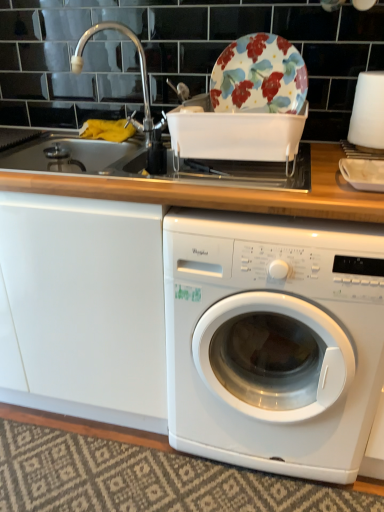
Describe the element at coordinates (259, 76) in the screenshot. The width and height of the screenshot is (384, 512). I see `floral ceramic plate at upper center` at that location.

You are a GUI agent. You are given a task and a screenshot of the screen. Output one action in this format:
    pyautogui.click(x=<x>, y=<y>)
    Task: Click on the white matte plate at right
    
    Given the screenshot: What is the action you would take?
    pyautogui.click(x=363, y=173)

The image size is (384, 512). I want to click on table in front of the silver metallic faucet at upper left, so click(x=259, y=76).

Is floral ceramic plate at upper center positioned far away from silver metallic faucet at upper left?

No.

Is floral ceramic plate at upper center turned away from silver metallic faucet at upper left?

floral ceramic plate at upper center does not have its back to silver metallic faucet at upper left.

How different are the orientations of floral ceramic plate at upper center and silver metallic faucet at upper left in degrees?

There is a 54.7-degree angle between the facing directions of floral ceramic plate at upper center and silver metallic faucet at upper left.

Find the location of `tableware above the white plastic washing machine at center (from the image's perspective)`. tableware above the white plastic washing machine at center (from the image's perspective) is located at coordinates coord(363,173).

Can you see white plastic washing machine at center touching white matte plate at right?

No, white plastic washing machine at center is not in contact with white matte plate at right.

From a real-world perspective, which is physically below, white plastic washing machine at center or white matte plate at right?

white plastic washing machine at center is physically lower.

Would you say white matte plate at right is part of white plastic washing machine at center's contents?

That's incorrect, white matte plate at right is not inside white plastic washing machine at center.

Considering the positions of objects silver metallic faucet at upper left and white matte plate at right in the image provided, who is more to the right, silver metallic faucet at upper left or white matte plate at right?

From the viewer's perspective, white matte plate at right appears more on the right side.

Between silver metallic faucet at upper left and white matte plate at right, which one has more height?

Standing taller between the two is silver metallic faucet at upper left.

In the scene shown: From the image's perspective, between silver metallic faucet at upper left and white matte plate at right, who is located below?

white matte plate at right is shown below in the image.

Which object is further away from the camera, white matte plate at right or white plastic washing machine at center?

white matte plate at right is further away from the camera.

Does white matte plate at right turn towards white plastic washing machine at center?

No, white matte plate at right is not turned towards white plastic washing machine at center.

Where is `tableware above the white plastic washing machine at center (from the image's perspective)`? This screenshot has width=384, height=512. tableware above the white plastic washing machine at center (from the image's perspective) is located at coordinates (363, 173).

Is silver metallic faucet at upper left outside of floral ceramic plate at upper center?

Yes, silver metallic faucet at upper left is located beyond the bounds of floral ceramic plate at upper center.

At what (x,y) coordinates should I click in order to perform the action: click on table that is in front of the silver metallic faucet at upper left. Please return your answer as a coordinate pair (x, y). This screenshot has width=384, height=512. Looking at the image, I should click on (259, 76).

Based on the photo, in the image, is silver metallic faucet at upper left positioned in front of or behind floral ceramic plate at upper center?

Visually, silver metallic faucet at upper left is located behind floral ceramic plate at upper center.

Is silver metallic faucet at upper left not near floral ceramic plate at upper center?

No, silver metallic faucet at upper left is in close proximity to floral ceramic plate at upper center.

Would you say white plastic washing machine at center is a long distance from floral ceramic plate at upper center?

They are positioned close to each other.

Could you tell me if white plastic washing machine at center is turned towards floral ceramic plate at upper center?

No, white plastic washing machine at center is not facing towards floral ceramic plate at upper center.

Is white plastic washing machine at center inside or outside of floral ceramic plate at upper center?

white plastic washing machine at center lies outside floral ceramic plate at upper center.

Is white plastic washing machine at center bigger than floral ceramic plate at upper center?

Indeed, white plastic washing machine at center has a larger size compared to floral ceramic plate at upper center.

Considering the positions of objects floral ceramic plate at upper center and white matte plate at right in the image provided, who is in front, floral ceramic plate at upper center or white matte plate at right?

white matte plate at right is more forward.

Considering the relative sizes of floral ceramic plate at upper center and white matte plate at right in the image provided, is floral ceramic plate at upper center shorter than white matte plate at right?

Incorrect, the height of floral ceramic plate at upper center does not fall short of that of white matte plate at right.

From a real-world perspective, does floral ceramic plate at upper center sit lower than white matte plate at right?

Incorrect, from a real-world perspective, floral ceramic plate at upper center is higher than white matte plate at right.

Locate an element on the screen. This screenshot has height=512, width=384. table above the silver metallic faucet at upper left (from a real-world perspective) is located at coordinates (259, 76).

Find the location of a particular element. The height and width of the screenshot is (512, 384). tableware above the white plastic washing machine at center (from the image's perspective) is located at coordinates (363, 173).

When comparing their distances from white plastic washing machine at center, does floral ceramic plate at upper center or silver metallic faucet at upper left seem further?

Among the two, silver metallic faucet at upper left is located further to white plastic washing machine at center.

Looking at the image, which one is located closer to silver metallic faucet at upper left, floral ceramic plate at upper center or white matte plate at right?

floral ceramic plate at upper center is positioned closer to the anchor silver metallic faucet at upper left.

Estimate the real-world distances between objects in this image. Which object is further from floral ceramic plate at upper center, white matte plate at right or silver metallic faucet at upper left?

silver metallic faucet at upper left lies further to floral ceramic plate at upper center than the other object.

When comparing their distances from white matte plate at right, does silver metallic faucet at upper left or white plastic washing machine at center seem further?

silver metallic faucet at upper left lies further to white matte plate at right than the other object.

From the picture: Which object lies nearer to the anchor point white plastic washing machine at center, white matte plate at right or floral ceramic plate at upper center?

white matte plate at right is closer to white plastic washing machine at center.

Consider the image. Looking at the image, which one is located further to silver metallic faucet at upper left, white plastic washing machine at center or floral ceramic plate at upper center?

white plastic washing machine at center.

Looking at the image, which one is located closer to white matte plate at right, white plastic washing machine at center or floral ceramic plate at upper center?

floral ceramic plate at upper center is closer to white matte plate at right.

Estimate the real-world distances between objects in this image. Which object is further from white matte plate at right, floral ceramic plate at upper center or white plastic washing machine at center?

The object further to white matte plate at right is white plastic washing machine at center.

I want to click on table situated between silver metallic faucet at upper left and white matte plate at right from left to right, so click(x=259, y=76).

This screenshot has width=384, height=512. Identify the location of tableware between floral ceramic plate at upper center and white plastic washing machine at center from top to bottom. (363, 173).

I want to click on washing machine between silver metallic faucet at upper left and white matte plate at right from left to right, so click(x=273, y=341).

Identify the location of table between silver metallic faucet at upper left and white plastic washing machine at center from top to bottom. The image size is (384, 512). (x=259, y=76).